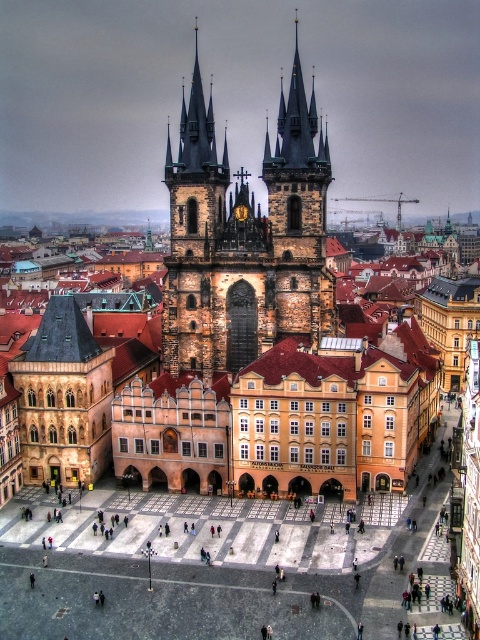
Who is shorter, dark stone church spires at center or brown stone tower at center?

Standing shorter between the two is brown stone tower at center.

Does dark stone church spires at center have a larger size compared to brown stone tower at center?

Yes, dark stone church spires at center is bigger than brown stone tower at center.

Locate an element on the screen. dark stone church spires at center is located at coordinates (245, 237).